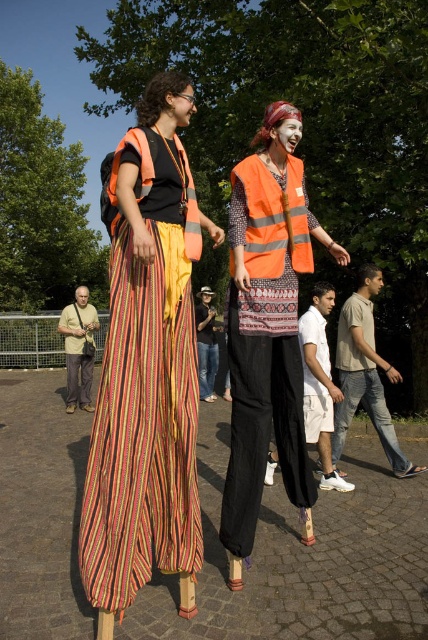
Can you confirm if light beige cotton shirt at lower right is smaller than matte orange vest at upper center?

Actually, light beige cotton shirt at lower right might be larger than matte orange vest at upper center.

Can you confirm if light beige cotton shirt at lower right is bigger than matte orange vest at upper center?

Correct, light beige cotton shirt at lower right is larger in size than matte orange vest at upper center.

Where is `light beige cotton shirt at lower right`? Image resolution: width=428 pixels, height=640 pixels. light beige cotton shirt at lower right is located at coordinates (365, 374).

Between striped fabric pants at left and reflective orange safety vest at center, which one is positioned lower?

Positioned lower is striped fabric pants at left.

Does striped fabric pants at left appear on the left side of reflective orange safety vest at center?

Yes, striped fabric pants at left is to the left of reflective orange safety vest at center.

Which is in front, point (136, 387) or point (247, 269)?

Positioned in front is point (136, 387).

Find the location of a particular element. The image size is (428, 640). striped fabric pants at left is located at coordinates (146, 372).

Can you confirm if striped fabric pants at left is positioned to the right of denim jeans at center?

Incorrect, striped fabric pants at left is not on the right side of denim jeans at center.

Is striped fabric pants at left taller than denim jeans at center?

Correct, striped fabric pants at left is much taller as denim jeans at center.

Who is more forward, (155,483) or (205,356)?

Point (155,483) is more forward.

Where is `striped fabric pants at left`? striped fabric pants at left is located at coordinates (146, 372).